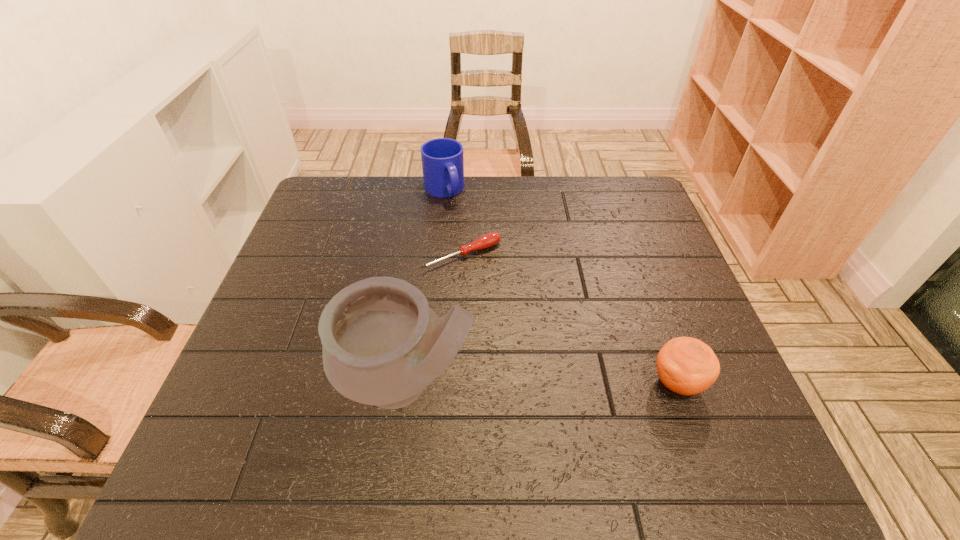
Locate an element on the screen. Image resolution: width=960 pixels, height=540 pixels. vacant area located on the side with the handle of the farthest object is located at coordinates (466, 230).

You are a GUI agent. You are given a task and a screenshot of the screen. Output one action in this format:
    pyautogui.click(x=<x>, y=<y>)
    Task: Click on the free spot located on the side with the handle of the farthest object
    The width and height of the screenshot is (960, 540).
    Given the screenshot: What is the action you would take?
    pyautogui.click(x=456, y=214)

Identify the location of free region located 0.340m on the side with the handle of the farthest object. (494, 278).

The image size is (960, 540). I want to click on object located at the far edge, so click(442, 159).

Locate an element on the screen. pottery that is at the near edge is located at coordinates (382, 344).

Locate an element on the screen. The height and width of the screenshot is (540, 960). orange situated at the near edge is located at coordinates (685, 365).

Image resolution: width=960 pixels, height=540 pixels. Find the location of `object present at the right edge`. object present at the right edge is located at coordinates (685, 365).

Find the location of a particular element. The height and width of the screenshot is (540, 960). object at the near right corner is located at coordinates pyautogui.click(x=685, y=365).

In order to click on vacant space at the far edge of the desktop in this screenshot , I will do `click(567, 185)`.

Identify the location of vacant space at the near edge. (563, 408).